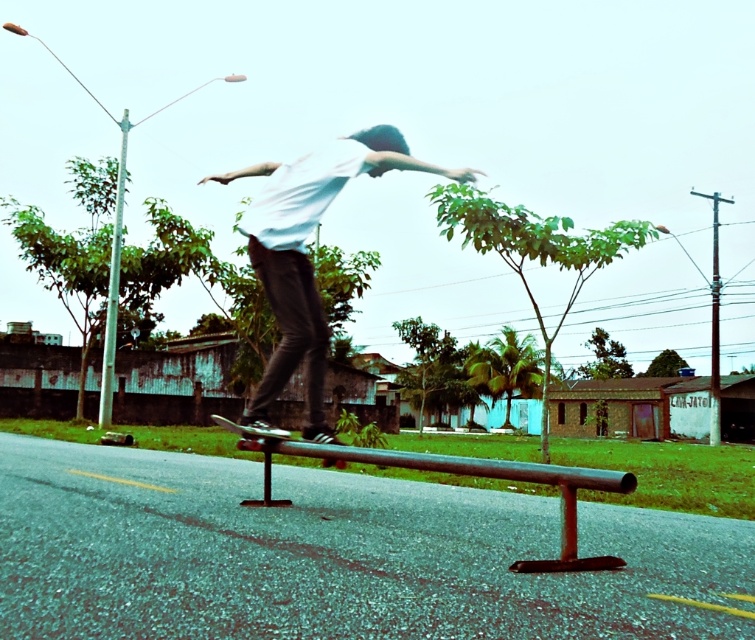
Looking at this image, does rusty metal rail at center have a smaller size compared to metallic silver skateboard at center?

Correct, rusty metal rail at center occupies less space than metallic silver skateboard at center.

Does rusty metal rail at center lie in front of metallic silver skateboard at center?

That is True.

Between point (322, 451) and point (233, 422), which one is positioned behind?

The point (233, 422) is more distant.

I want to click on rusty metal rail at center, so click(x=461, y=474).

Who is more forward, (307, 339) or (618, 484)?

Point (618, 484) is more forward.

Does white matte skateboarder at center have a lesser height compared to rusty metal rail at center?

No.

This screenshot has height=640, width=755. What are the coordinates of `white matte skateboarder at center` in the screenshot? It's located at (307, 257).

The image size is (755, 640). I want to click on white matte skateboarder at center, so click(307, 257).

Does white matte skateboarder at center have a larger size compared to metallic silver skateboard at center?

Correct, white matte skateboarder at center is larger in size than metallic silver skateboard at center.

Looking at this image, does white matte skateboarder at center have a lesser height compared to metallic silver skateboard at center?

Incorrect, white matte skateboarder at center's height does not fall short of metallic silver skateboard at center's.

Based on the photo, who is more forward, (x=296, y=353) or (x=331, y=464)?

Positioned in front is point (x=296, y=353).

The image size is (755, 640). Identify the location of white matte skateboarder at center. (307, 257).